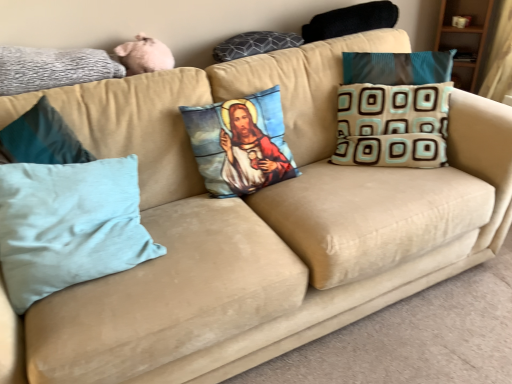
Question: From a real-world perspective, is printed fabric pillow with religious imagery at center, which is the third pillow in left-to-right order, physically located above or below gray textured pillow at upper left, the first pillow in the left-to-right sequence?

Choices:
 (A) above
 (B) below

Answer: (B)

Question: Looking at the image, does printed fabric pillow with religious imagery at center, which is the third pillow in left-to-right order, seem bigger or smaller compared to gray textured pillow at upper left, which ranks as the 6th pillow in right-to-left order?

Choices:
 (A) small
 (B) big

Answer: (B)

Question: Which is nearer to the dark gray textured pillow at upper center, which ranks as the fourth pillow in left-to-right order?

Choices:
 (A) black fuzzy pillow at upper right, which appears as the 5th pillow when viewed from the left
 (B) printed fabric pillow with religious imagery at center, the fourth pillow in the right-to-left sequence
 (C) gray textured pillow at upper left, the first pillow in the left-to-right sequence
 (D) beige fabric pillow with blue and brown squares at right, which appears as the first pillow when viewed from the right
 (E) light blue fabric pillow at left, which ranks as the second pillow in left-to-right order

Answer: (A)

Question: Estimate the real-world distances between objects in this image. Which object is closer to the black fuzzy pillow at upper right, which appears as the 5th pillow when viewed from the left?

Choices:
 (A) gray textured pillow at upper left, which ranks as the 6th pillow in right-to-left order
 (B) printed fabric pillow with religious imagery at center, the fourth pillow in the right-to-left sequence
 (C) beige fabric pillow with blue and brown squares at right, acting as the 6th pillow starting from the left
 (D) light blue fabric pillow at left, which is counted as the fifth pillow, starting from the right
 (E) dark gray textured pillow at upper center, placed as the 3th pillow when sorted from right to left

Answer: (E)